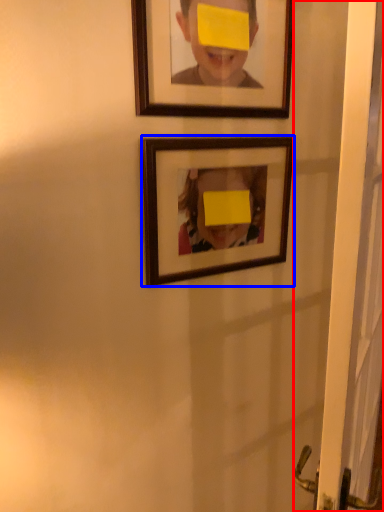
Question: Which object appears closest to the camera in this image, screen door (highlighted by a red box) or picture frame (highlighted by a blue box)?

Choices:
 (A) screen door
 (B) picture frame

Answer: (A)